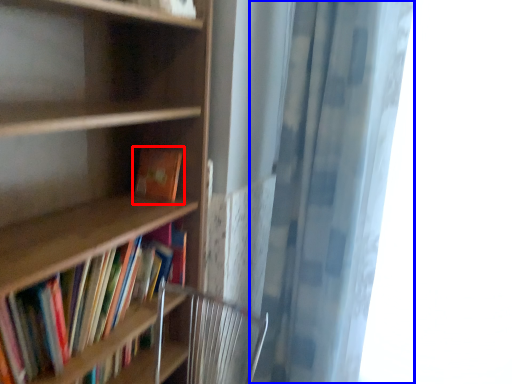
Question: Which object is closer to the camera taking this photo, book (highlighted by a red box) or shower curtain (highlighted by a blue box)?

Choices:
 (A) book
 (B) shower curtain

Answer: (B)